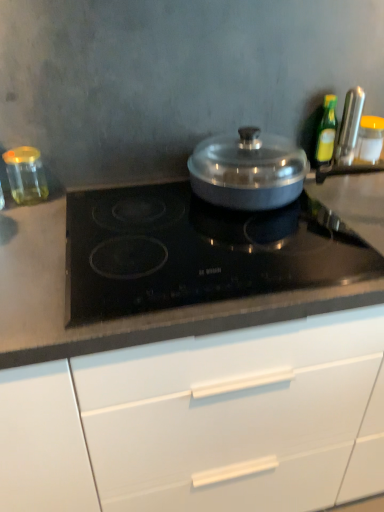
Question: Considering the relative sizes of green glass bottle at upper right, marked as the second kitchen appliance in a left-to-right arrangement, and transparent glass jar at left, the first kitchen appliance in the left-to-right sequence, in the image provided, is green glass bottle at upper right, marked as the second kitchen appliance in a left-to-right arrangement, shorter than transparent glass jar at left, the first kitchen appliance in the left-to-right sequence,?

Choices:
 (A) yes
 (B) no

Answer: (B)

Question: From the image's perspective, is green glass bottle at upper right, positioned as the 3th kitchen appliance in right-to-left order, located beneath transparent glass jar at left, the first kitchen appliance in the left-to-right sequence?

Choices:
 (A) yes
 (B) no

Answer: (B)

Question: Is green glass bottle at upper right, positioned as the 3th kitchen appliance in right-to-left order, closer to the viewer compared to transparent glass jar at left, the first kitchen appliance in the left-to-right sequence?

Choices:
 (A) no
 (B) yes

Answer: (A)

Question: Could you tell me if green glass bottle at upper right, marked as the second kitchen appliance in a left-to-right arrangement, is turned towards transparent glass jar at left, the first kitchen appliance in the left-to-right sequence?

Choices:
 (A) yes
 (B) no

Answer: (B)

Question: Does green glass bottle at upper right, positioned as the 3th kitchen appliance in right-to-left order, appear on the right side of transparent glass jar at left, the first kitchen appliance in the left-to-right sequence?

Choices:
 (A) yes
 (B) no

Answer: (A)

Question: Considering the relative sizes of green glass bottle at upper right, marked as the second kitchen appliance in a left-to-right arrangement, and transparent glass jar at left, arranged as the fourth kitchen appliance when viewed from the right, in the image provided, is green glass bottle at upper right, marked as the second kitchen appliance in a left-to-right arrangement, smaller than transparent glass jar at left, arranged as the fourth kitchen appliance when viewed from the right,?

Choices:
 (A) no
 (B) yes

Answer: (B)

Question: From a real-world perspective, is transparent glass jar at left, arranged as the fourth kitchen appliance when viewed from the right, on white matte cabinet at center?

Choices:
 (A) yes
 (B) no

Answer: (A)

Question: Can you confirm if transparent glass jar at left, the first kitchen appliance in the left-to-right sequence, is positioned to the right of white matte cabinet at center?

Choices:
 (A) yes
 (B) no

Answer: (B)

Question: Can you confirm if transparent glass jar at left, arranged as the fourth kitchen appliance when viewed from the right, is shorter than white matte cabinet at center?

Choices:
 (A) yes
 (B) no

Answer: (A)

Question: Could you tell me if transparent glass jar at left, the first kitchen appliance in the left-to-right sequence, is turned towards white matte cabinet at center?

Choices:
 (A) no
 (B) yes

Answer: (A)

Question: Does transparent glass jar at left, the first kitchen appliance in the left-to-right sequence, have a greater width compared to white matte cabinet at center?

Choices:
 (A) yes
 (B) no

Answer: (B)

Question: Is transparent glass jar at left, the first kitchen appliance in the left-to-right sequence, outside of white matte cabinet at center?

Choices:
 (A) no
 (B) yes

Answer: (B)

Question: Considering the relative positions of metallic silver knife at upper right, the 2th kitchen appliance viewed from the right, and yellow lid glass jar at right, the 4th kitchen appliance viewed from the left, in the image provided, is metallic silver knife at upper right, the 2th kitchen appliance viewed from the right, to the right of yellow lid glass jar at right, the 4th kitchen appliance viewed from the left, from the viewer's perspective?

Choices:
 (A) no
 (B) yes

Answer: (A)